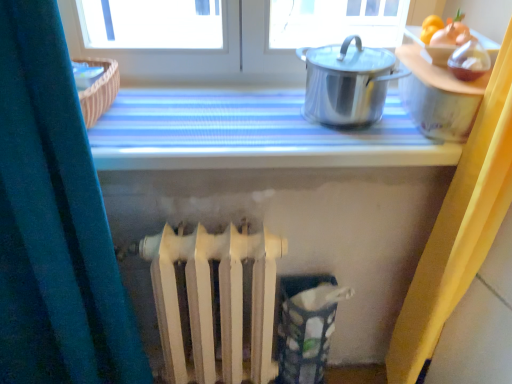
Question: Should I look upward or downward to see white matte radiator at center?

Choices:
 (A) down
 (B) up

Answer: (A)

Question: Does polished stainless steel pot at upper right appear on the left side of metallic silver pot at upper right?

Choices:
 (A) no
 (B) yes

Answer: (A)

Question: Is polished stainless steel pot at upper right shorter than metallic silver pot at upper right?

Choices:
 (A) yes
 (B) no

Answer: (B)

Question: Is polished stainless steel pot at upper right oriented away from metallic silver pot at upper right?

Choices:
 (A) yes
 (B) no

Answer: (B)

Question: Is metallic silver pot at upper right inside polished stainless steel pot at upper right?

Choices:
 (A) yes
 (B) no

Answer: (B)

Question: Is polished stainless steel pot at upper right bigger than metallic silver pot at upper right?

Choices:
 (A) yes
 (B) no

Answer: (B)

Question: Is polished stainless steel pot at upper right taller than metallic silver pot at upper right?

Choices:
 (A) yes
 (B) no

Answer: (A)

Question: Does polished stainless steel pot at upper right have a lesser height compared to white matte radiator at center?

Choices:
 (A) no
 (B) yes

Answer: (B)

Question: From the image's perspective, is polished stainless steel pot at upper right above white matte radiator at center?

Choices:
 (A) yes
 (B) no

Answer: (A)

Question: Considering the relative sizes of polished stainless steel pot at upper right and white matte radiator at center in the image provided, is polished stainless steel pot at upper right thinner than white matte radiator at center?

Choices:
 (A) yes
 (B) no

Answer: (B)

Question: Considering the relative positions of polished stainless steel pot at upper right and white matte radiator at center in the image provided, is polished stainless steel pot at upper right behind white matte radiator at center?

Choices:
 (A) no
 (B) yes

Answer: (A)

Question: Is polished stainless steel pot at upper right positioned with its back to white matte radiator at center?

Choices:
 (A) no
 (B) yes

Answer: (A)

Question: Is the depth of polished stainless steel pot at upper right less than that of white matte radiator at center?

Choices:
 (A) no
 (B) yes

Answer: (B)

Question: From the image's perspective, is metallic silver pot at upper right over white matte radiator at center?

Choices:
 (A) yes
 (B) no

Answer: (A)